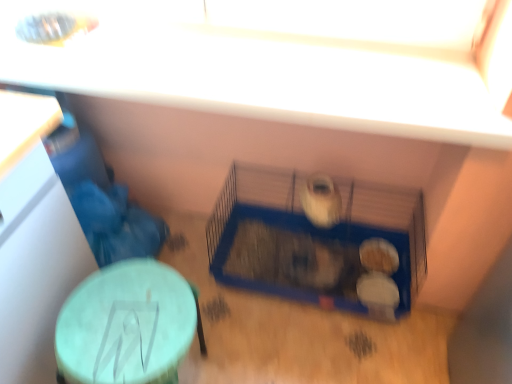
Where is `vacant area on top of green matte table at lower left (from a real-world perspective)`? The height and width of the screenshot is (384, 512). vacant area on top of green matte table at lower left (from a real-world perspective) is located at coordinates (125, 317).